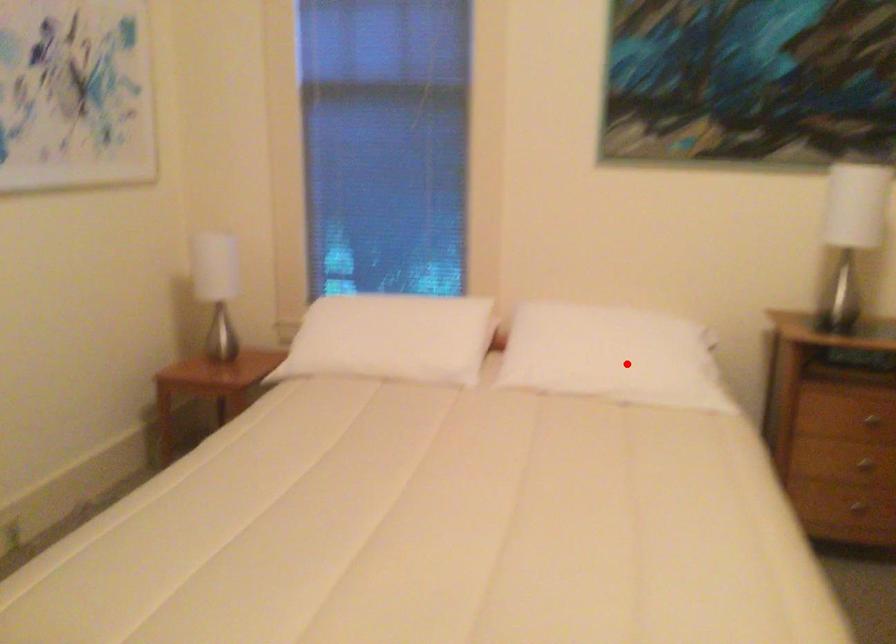
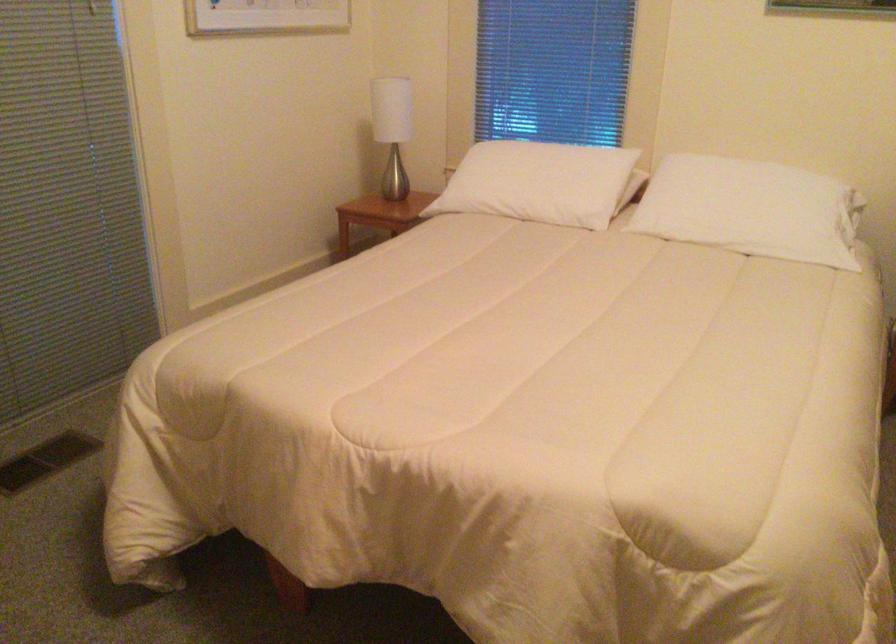
The point at the highlighted location is marked in the first image. Where is the corresponding point in the second image?

(752, 210)